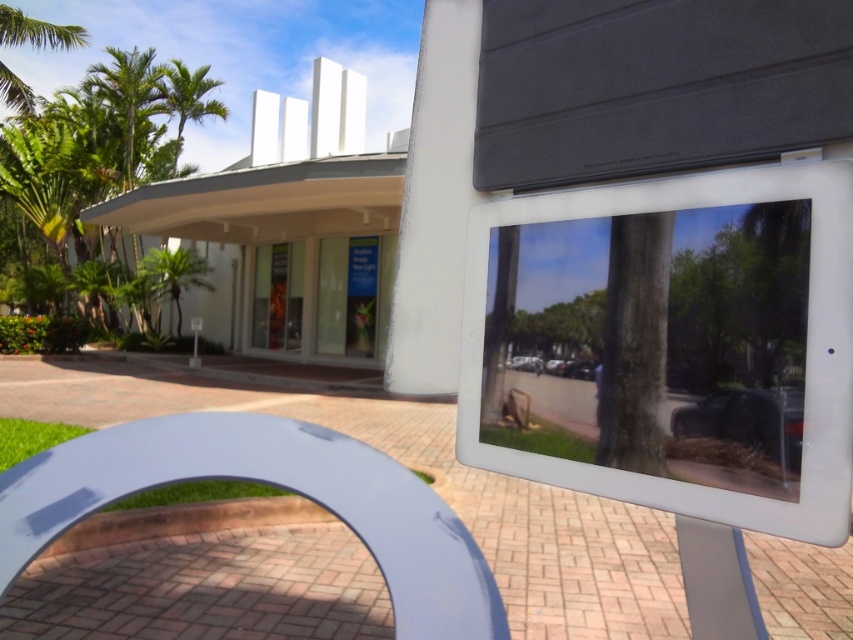
Question: Is green leafy palm tree at upper left behind green leafy palm tree at center?

Choices:
 (A) yes
 (B) no

Answer: (A)

Question: Does green leafy palm tree at upper left have a lesser width compared to green leafy palm tree at center?

Choices:
 (A) no
 (B) yes

Answer: (A)

Question: Does green leafy palm tree at upper left have a larger size compared to green leafy palm tree at center?

Choices:
 (A) no
 (B) yes

Answer: (B)

Question: Among these objects, which one is nearest to the camera?

Choices:
 (A) green leafy palm tree at center
 (B) green leafy palm tree at upper left

Answer: (A)

Question: Which point is closer to the camera taking this photo?

Choices:
 (A) (143, 260)
 (B) (202, 97)

Answer: (A)